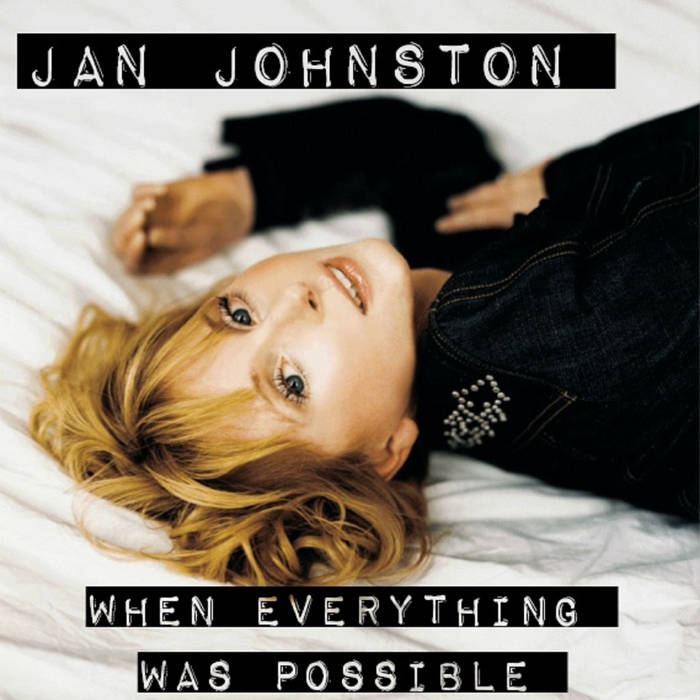
At what (x,y) coordinates should I click in order to perform the action: click on white sheet. Please return your answer as a coordinate pair (x, y). The image size is (700, 700). Looking at the image, I should click on (50, 157), (678, 580), (40, 581).